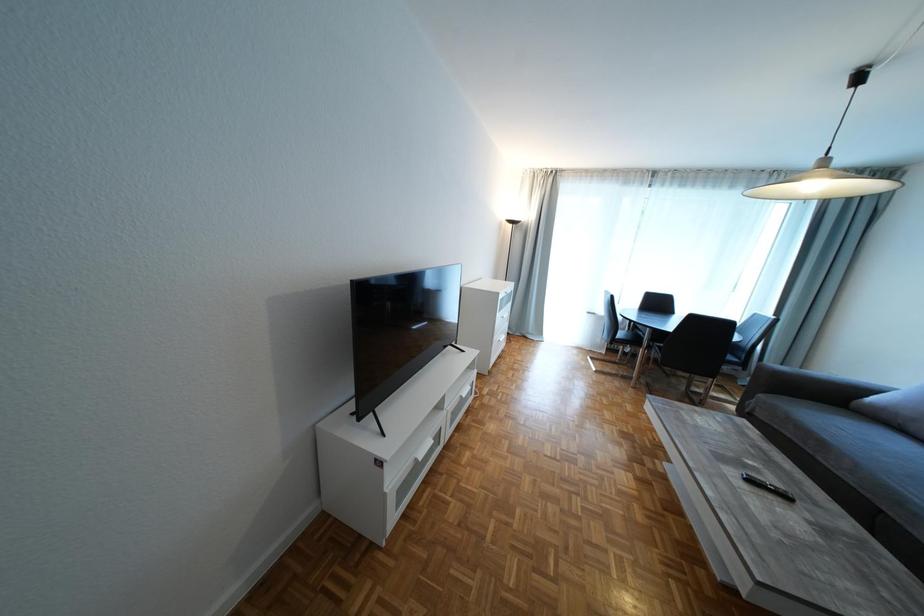
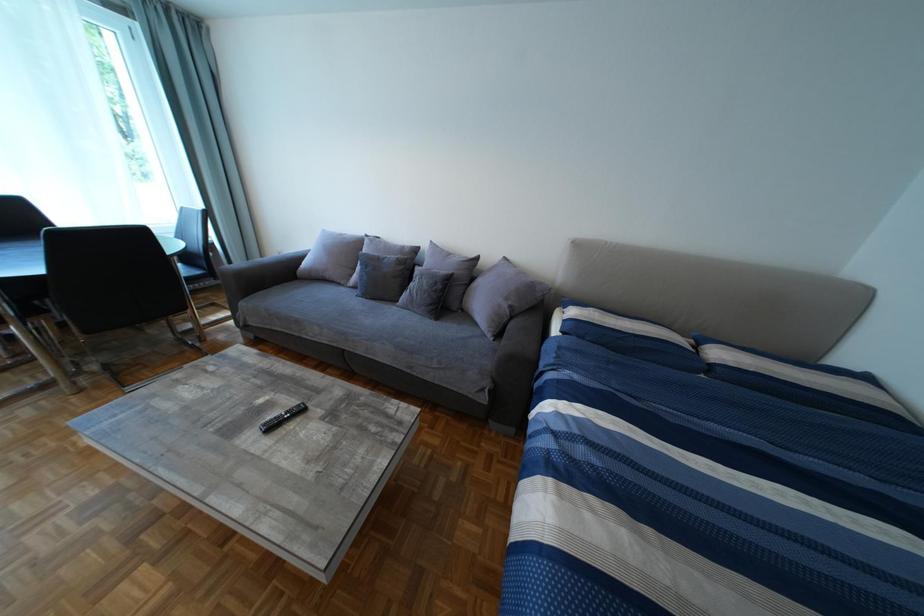
How did the camera likely rotate?

The rotation direction of the camera is right-down.